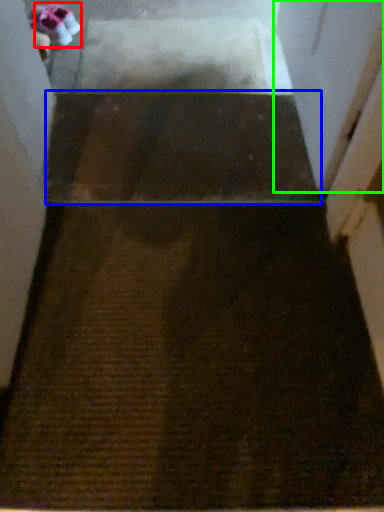
Question: Estimate the real-world distances between objects in this image. Which object is farther from shoe (highlighted by a red box), stairwell (highlighted by a blue box) or screen door (highlighted by a green box)?

Choices:
 (A) stairwell
 (B) screen door

Answer: (B)